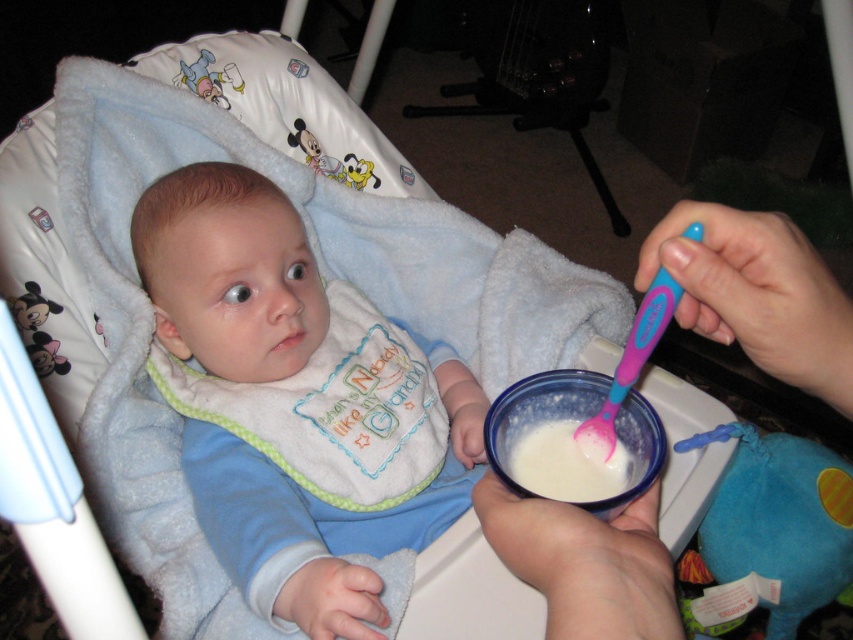
Between point (830, 529) and point (630, 388), which one is positioned behind?

Positioned behind is point (830, 529).

Who is more forward, (813,552) or (532,388)?

Point (532,388) is more forward.

This screenshot has width=853, height=640. What are the coordinates of `blue plush toy at lower right` in the screenshot? It's located at (770, 532).

Does point (386, 348) come behind point (663, 285)?

Yes.

Can you confirm if blue soft bib at center is shorter than pink plastic spoon at upper center?

Incorrect, blue soft bib at center's height does not fall short of pink plastic spoon at upper center's.

Where is `blue soft bib at center`? This screenshot has height=640, width=853. blue soft bib at center is located at coordinates (299, 401).

Is blue soft bib at center shorter than blue plush toy at lower right?

No.

Which of these two, blue soft bib at center or blue plush toy at lower right, stands shorter?

blue plush toy at lower right is shorter.

Is point (293, 515) in front of point (782, 532)?

Yes.

Identify the location of blue soft bib at center. This screenshot has height=640, width=853. (299, 401).